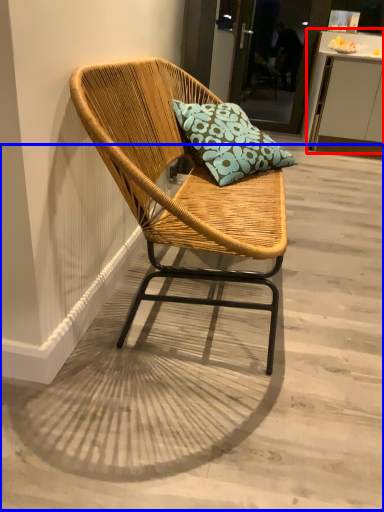
Question: Which object is closer to the camera taking this photo, table (highlighted by a red box) or concrete (highlighted by a blue box)?

Choices:
 (A) table
 (B) concrete

Answer: (B)